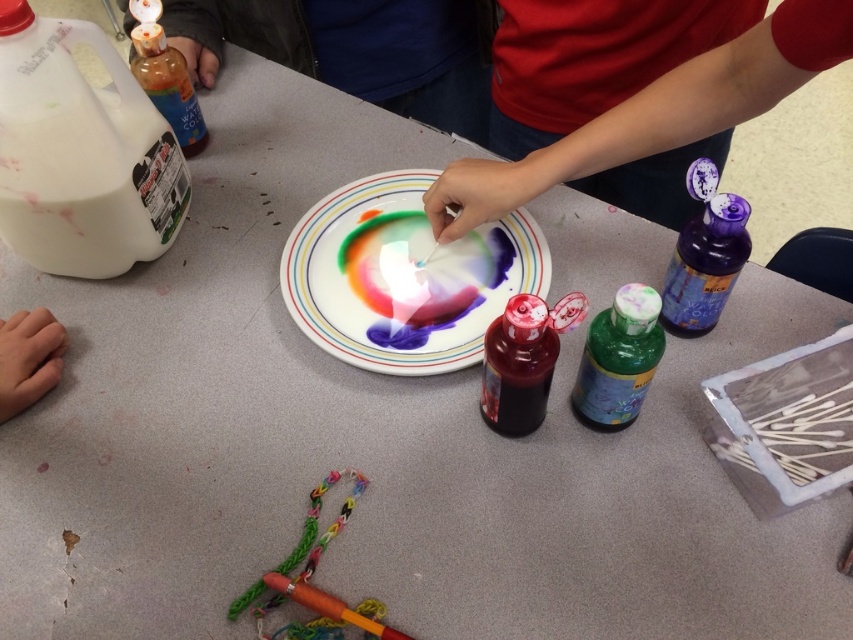
You are a teacher preparing a science experiment for the children. You need to choose the taller bottle between the purple translucent bottle at upper right and the green matte bottle at center to hold more liquid. Which one should you select?

The purple translucent bottle at upper right is much taller than the green matte bottle at center, so you should select the purple translucent bottle at upper right to hold more liquid.

You are a teacher observing the science experiment setup. The smooth red shirt at upper right belongs to a student who needs to reach the milk jug on the left. Based on their current position, can they comfortably reach the jug without moving their chair?

The smooth red shirt at upper right is positioned at point [657,113], which is near the upper right corner of the scene. Since the milk jug is on the left side of the frame, the student would need to stretch or move their chair to reach it comfortably.

You are a child participating in this activity and want to reach for the green matte bottle at center and the purple translucent bottle at upper right. Which one can you grab first without moving the other?

The green matte bottle at center is behind the purple translucent bottle at upper right, so you can grab the purple translucent bottle at upper right first without moving the other.